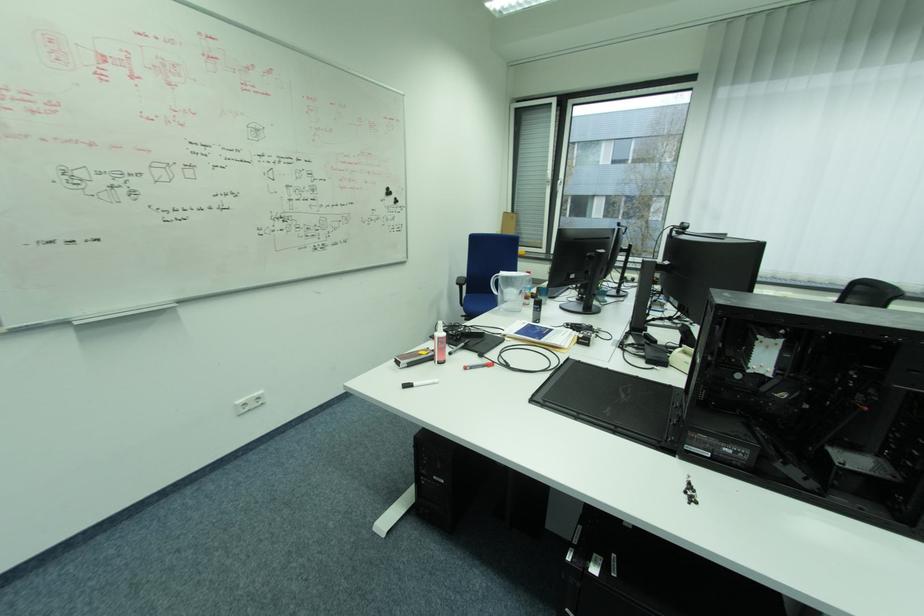
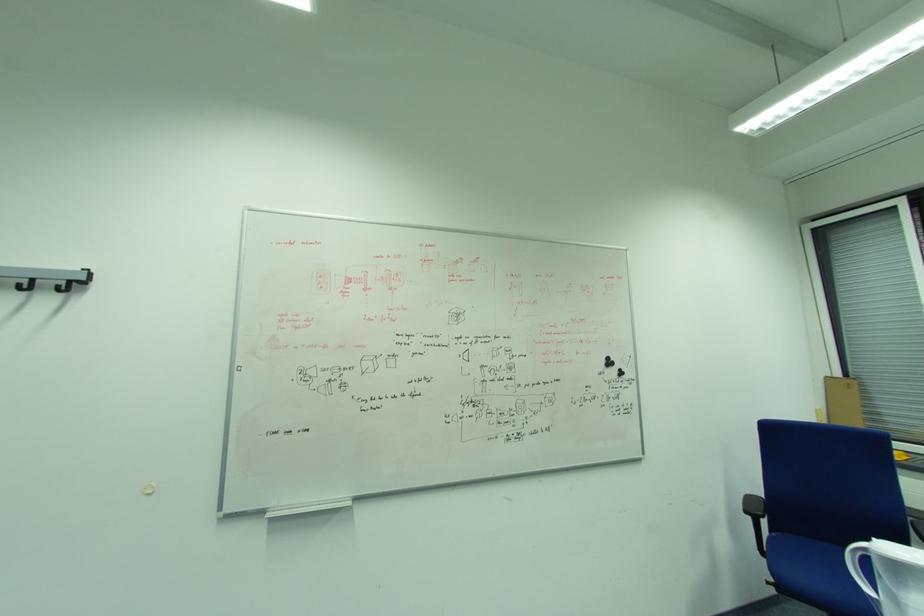
The point at [503,293] is marked in the first image. Where is the corresponding point in the second image?

(876, 591)